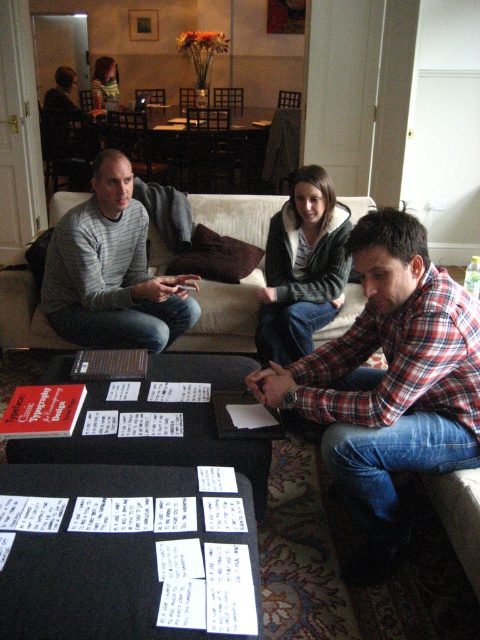
You are a delivery person who needs to place a small package between the plaid flannel shirt at center and the matte gray sweater at center on the coffee table. Can you fit the package there if it measures 1 meter in length?

The plaid flannel shirt at center and matte gray sweater at center are 1.05 meters apart from each other. Since the package is 1 meter long, it can fit between them as the space is slightly larger than the package.

You are organizing a game night and need to place a large board game box on the coffee table. The board game box is the same size as the matte gray sweater at center. Can you fit it next to the white paper cards at lower center without moving anything else?

The white paper cards at lower center occupies less space than the matte gray sweater at center. Since the board game box is the same size as the matte gray sweater at center, it would require more space than the white paper cards at lower center currently take up. Therefore, you cannot fit the board game box next to the white paper cards at lower center without moving something else.